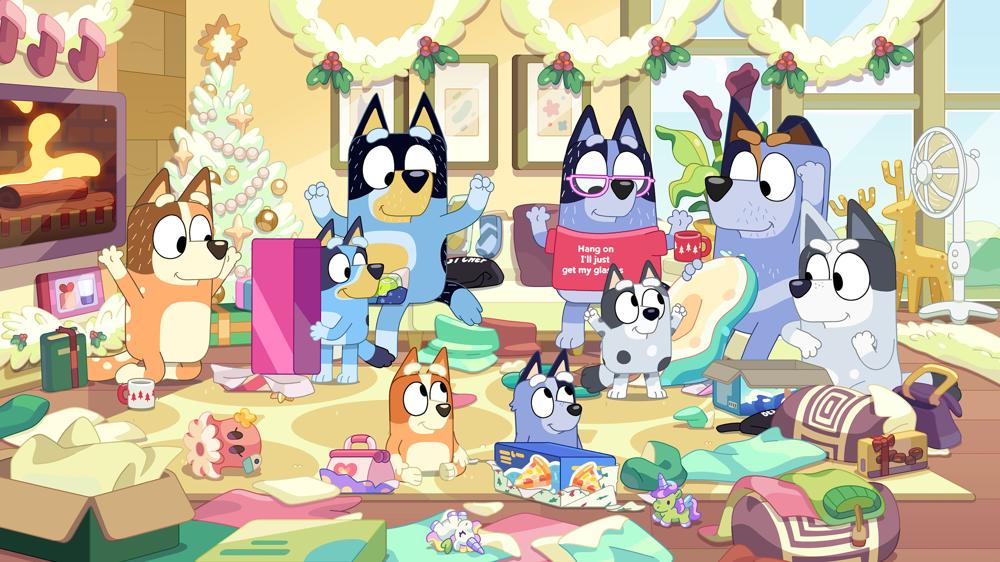
The height and width of the screenshot is (562, 1000). In order to click on box in this screenshot , I will do `click(85, 512)`, `click(284, 314)`, `click(557, 475)`, `click(758, 373)`, `click(247, 303)`, `click(225, 328)`.